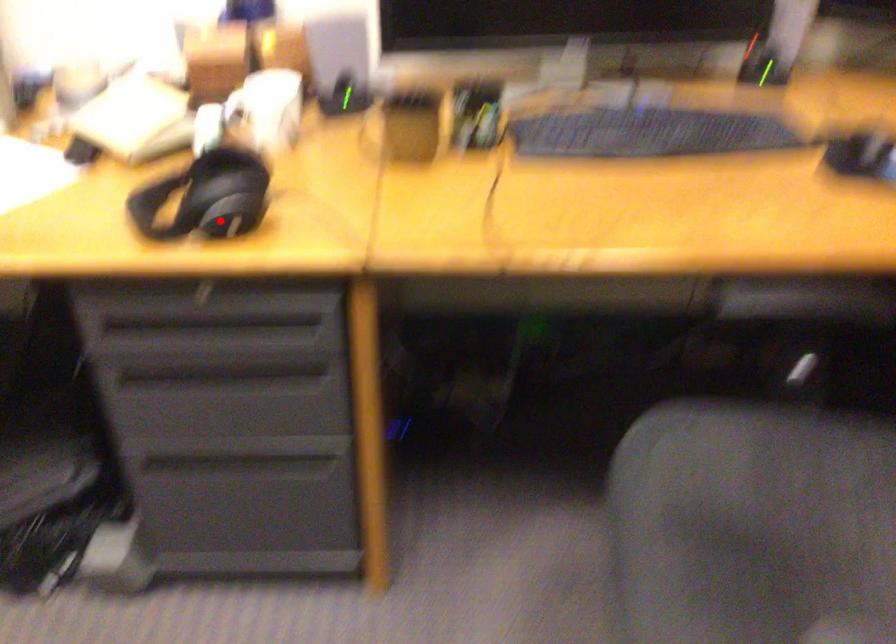
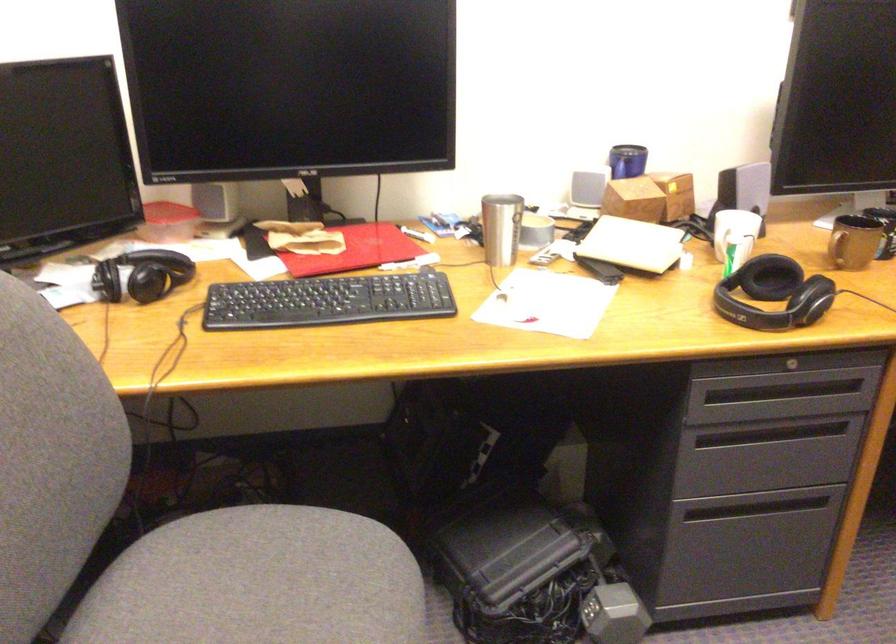
Locate, in the second image, the point that corresponds to the highlighted location in the first image.

(810, 299)